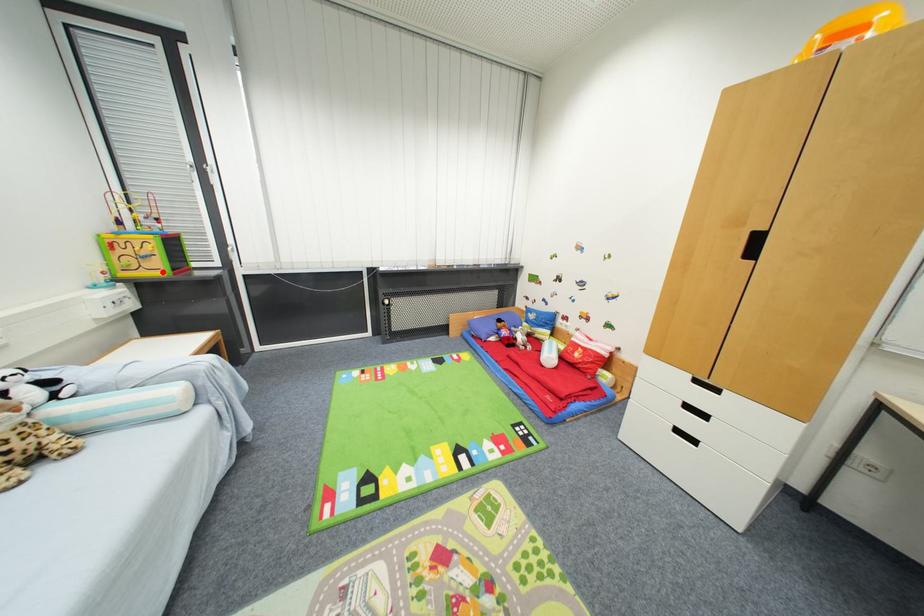
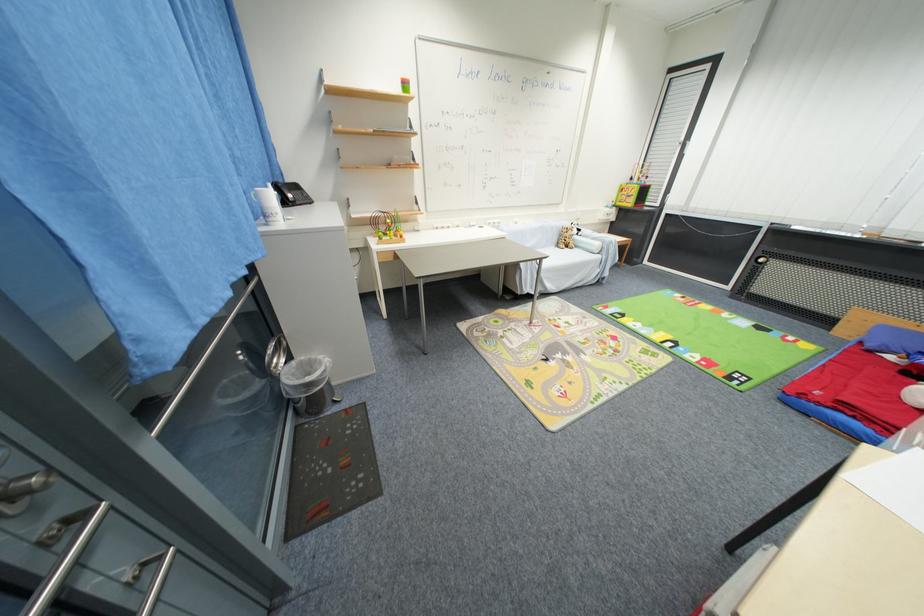
In the second image, find the point that corresponds to the highlighted location in the first image.

(635, 206)